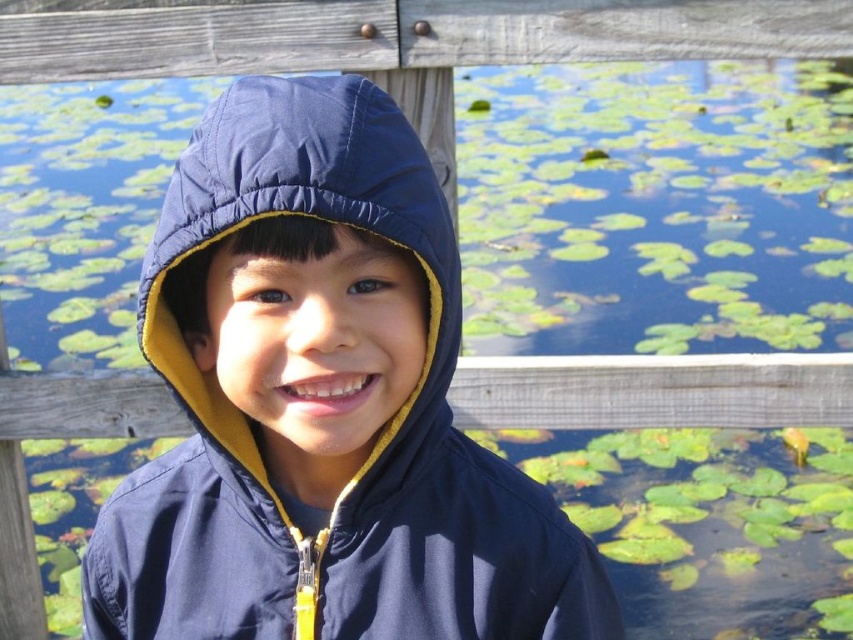
Is point (450, 420) positioned after point (192, 321)?

Yes, point (450, 420) is farther from viewer.

Can you confirm if navy blue jacket at center is wider than navy blue quilted hood at center?

Yes.

Which is behind, point (450, 330) or point (196, 216)?

The point (450, 330) is behind.

The height and width of the screenshot is (640, 853). I want to click on navy blue jacket at center, so click(321, 404).